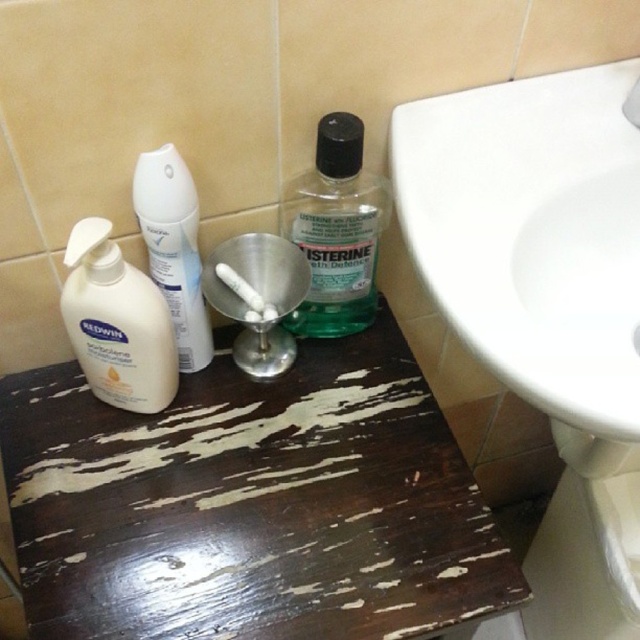
Who is positioned more to the right, white glossy sink at upper right or white matte spray can at center?

white glossy sink at upper right

Which is behind, point (632, 273) or point (154, 234)?

The point (632, 273) is more distant.

At what (x,y) coordinates should I click in order to perform the action: click on white glossy sink at upper right. Please return your answer as a coordinate pair (x, y). Image resolution: width=640 pixels, height=640 pixels. Looking at the image, I should click on (532, 234).

Between dark wood table at center and green translucent plastic mouthwash at center, which one is positioned lower?

dark wood table at center is lower down.

Who is more distant from viewer, (211, 596) or (317, 134)?

The point (317, 134) is more distant.

The height and width of the screenshot is (640, 640). Identify the location of dark wood table at center. (250, 502).

Does white glossy sink at upper right have a lesser height compared to white matte lotion at left?

Incorrect, white glossy sink at upper right's height does not fall short of white matte lotion at left's.

The image size is (640, 640). Describe the element at coordinates (532, 234) in the screenshot. I see `white glossy sink at upper right` at that location.

What are the coordinates of `white glossy sink at upper right` in the screenshot? It's located at tap(532, 234).